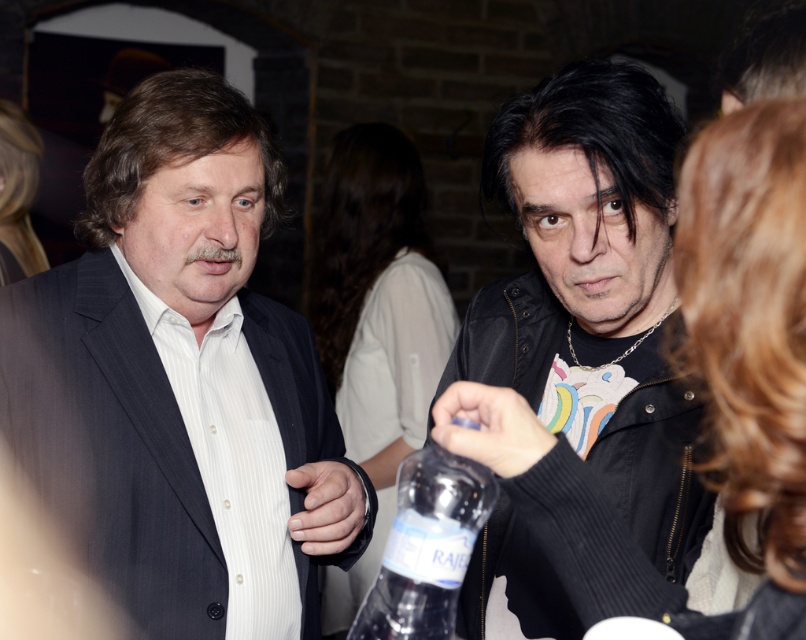
Based on the scene description, can you determine the spatial relationship between the black leather jacket at center and the clear plastic bottle at center?

The black leather jacket at center is positioned above the clear plastic bottle at center.

What are the coordinates of the matte black suit at left?

The coordinates of the matte black suit at left are at point (181,381).

Based on the scene described, which object is wider, the matte black suit at left or the black leather jacket at center?

The matte black suit at left is wider than the black leather jacket at center according to the description.